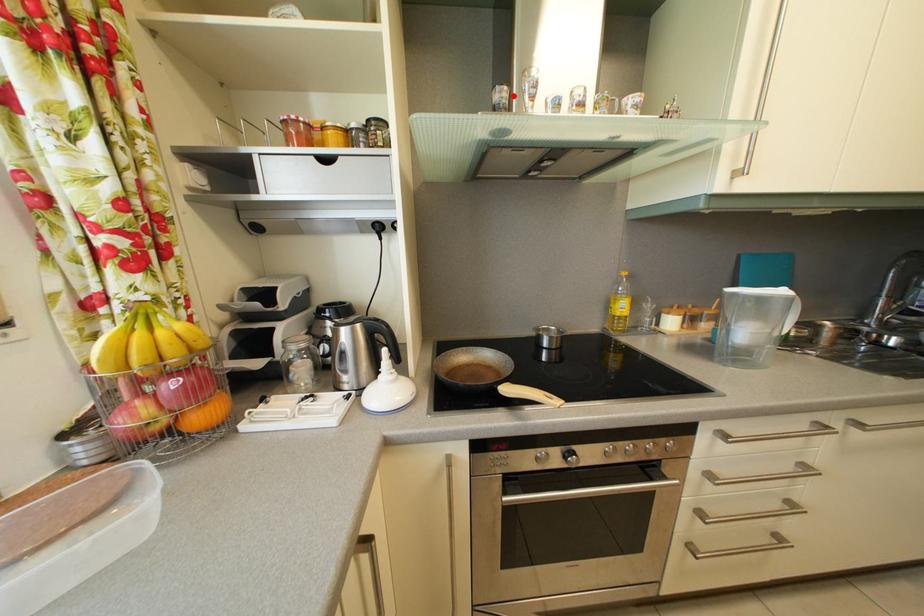
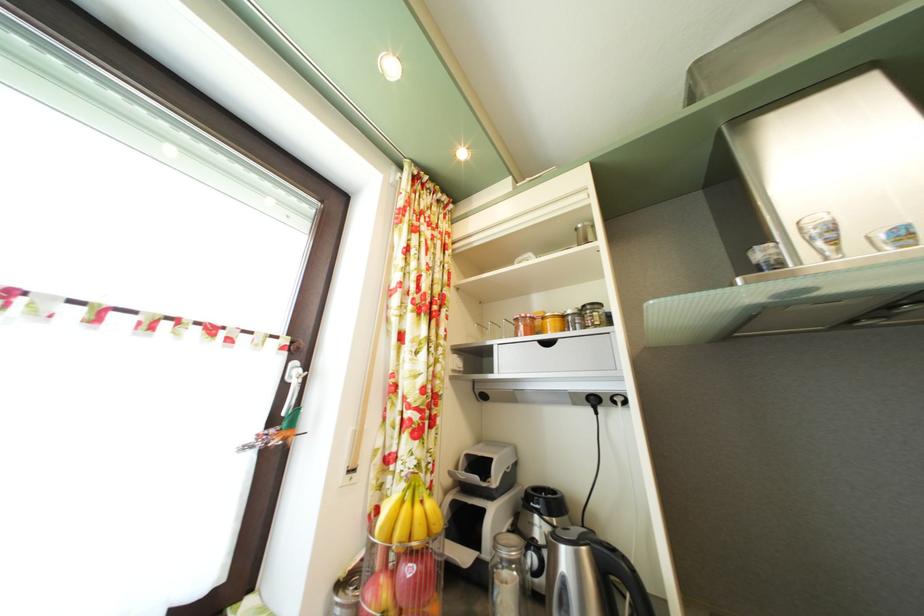
Question: I am providing you with two images of the same scene from different viewpoints. A red point is marked on the first image. Is the red point's position out of view in image 2?

Choices:
 (A) Yes
 (B) No

Answer: (B)